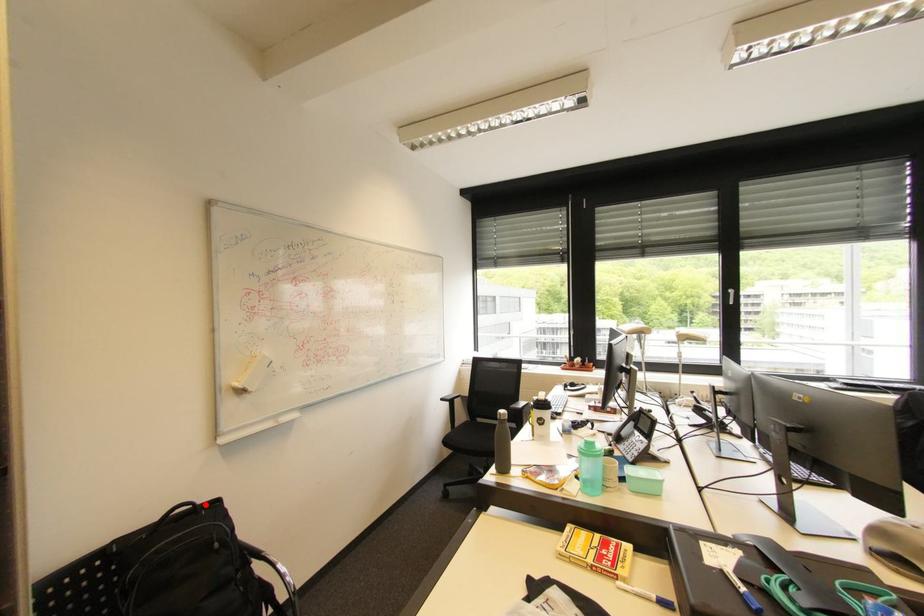
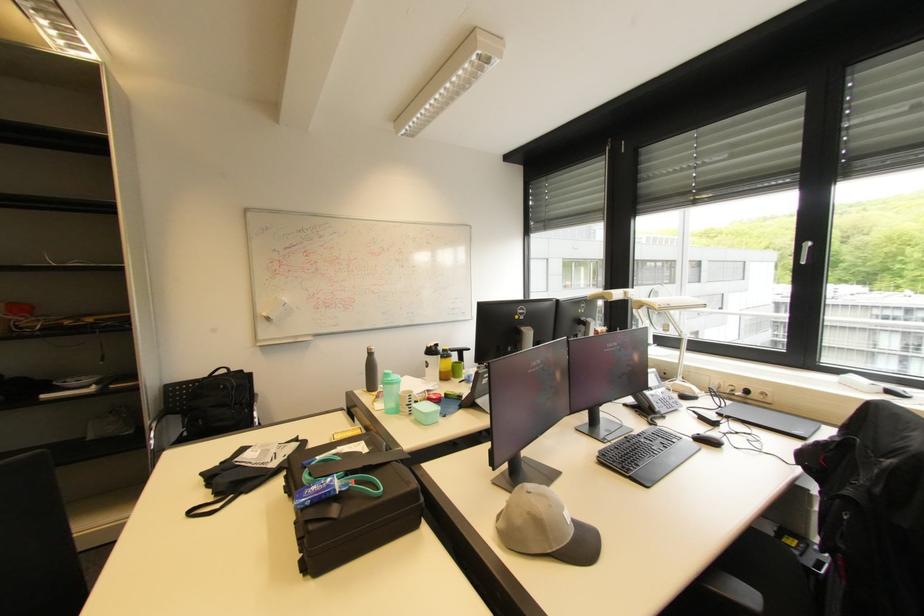
Find the pixel in the second image that matches the highlighted location in the first image.

(237, 371)